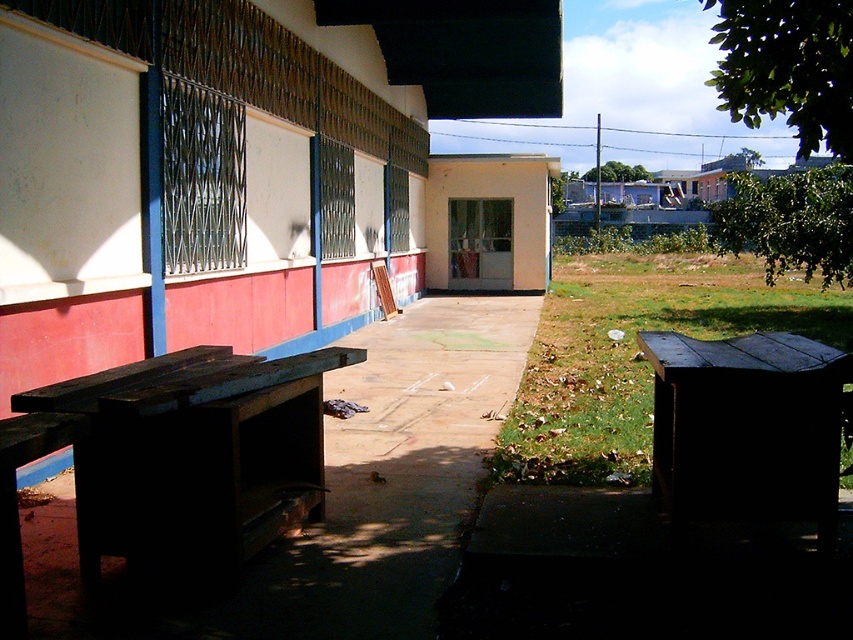
Question: Which of these objects is positioned farthest from the beige matte hut at center?

Choices:
 (A) dark wood bench at left
 (B) wooden bench at left
 (C) dark wood picnic table at lower right

Answer: (A)

Question: From the image, what is the correct spatial relationship of dark wood bench at left in relation to beige matte hut at center?

Choices:
 (A) below
 (B) above

Answer: (A)

Question: Among these objects, which one is farthest from the camera?

Choices:
 (A) beige matte hut at center
 (B) wooden bench at left

Answer: (A)

Question: Is wooden bench at left behind dark wood bench at left?

Choices:
 (A) yes
 (B) no

Answer: (A)

Question: Does wooden bench at left lie behind dark wood bench at left?

Choices:
 (A) yes
 (B) no

Answer: (A)

Question: Estimate the real-world distances between objects in this image. Which object is closer to the dark wood picnic table at lower right?

Choices:
 (A) wooden bench at left
 (B) beige matte hut at center
 (C) dark wood bench at left

Answer: (C)